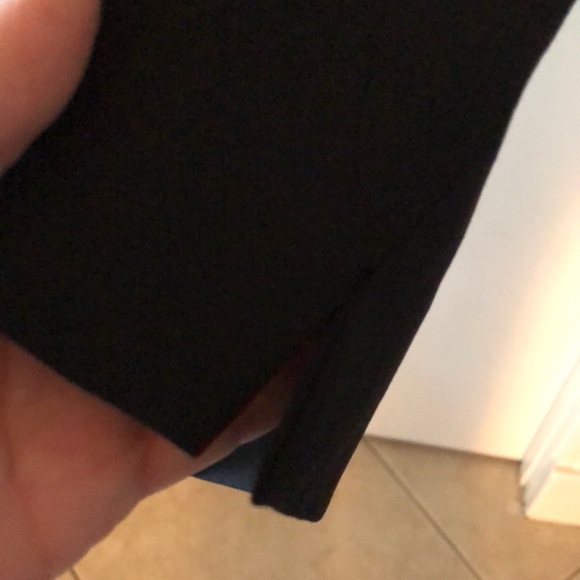
Locate an element on the screen. This screenshot has width=580, height=580. crack in floor is located at coordinates (397, 482), (445, 538).